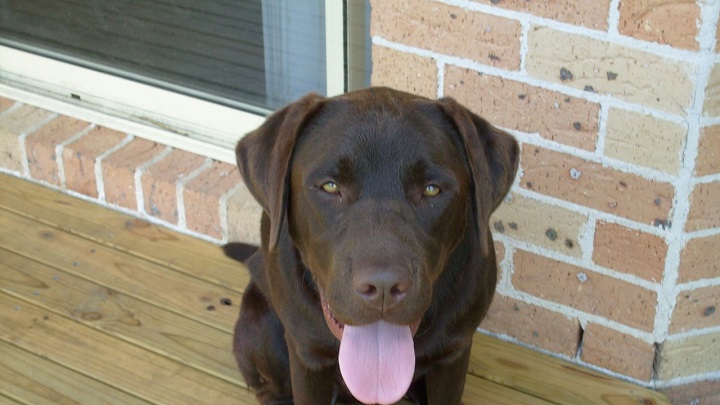
Identify the location of wooden planks. click(178, 374), click(180, 331), click(179, 252), click(168, 283), click(60, 389), click(1, 400), click(520, 367), click(495, 387).